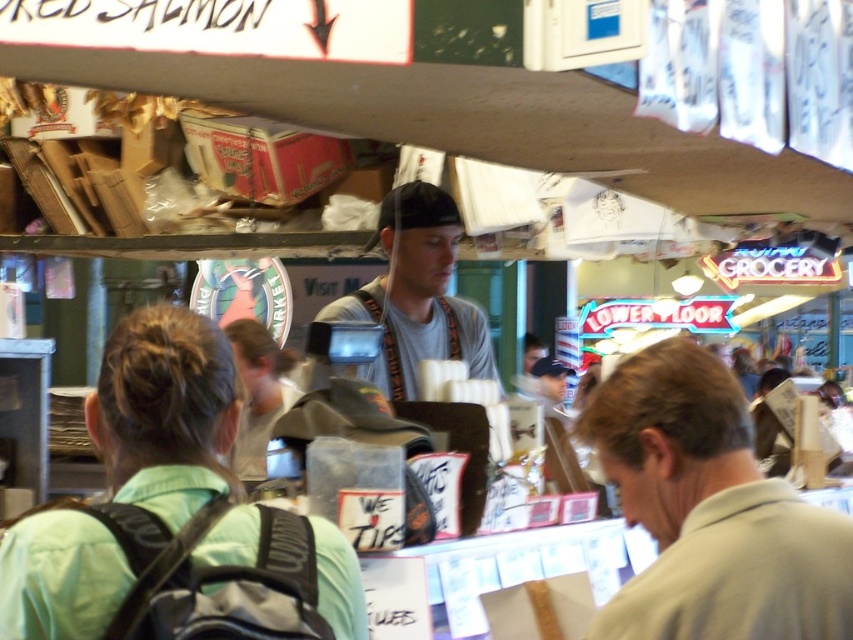
You are a customer at the counter and need to hand the cashier a form. The form is in your bag, which is the green fabric backpack at lower left. The cashier is wearing the gray fabric shirt at center. To reach the cashier, do you need to move your backpack?

The green fabric backpack at lower left is in front of the gray fabric shirt at center, so you would need to move the backpack to access the cashier.

Looking at this image, you are a customer trying to reach the counter in the market scene. There is a green fabric backpack at lower left and a gray fabric cap at center in your way. Which obstacle is closer to the counter?

The green fabric backpack at lower left is shorter than the gray fabric cap at center, so the backpack is closer to the counter.

You are a store employee and need to place both the green fabric backpack at lower left and the gray fabric cap at center on a shelf. Which item should you place first if you want to use the least amount of shelf space?

The green fabric backpack at lower left should be placed first because it occupies less space than the gray fabric cap at center, allowing for more efficient use of shelf space.